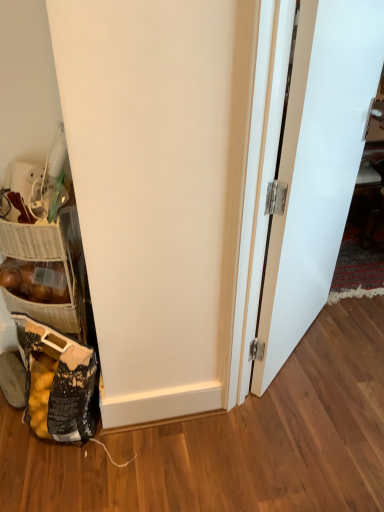
Question: Choose the correct answer: Is woven brown basket at lower left inside black plastic bag at lower left or outside it?

Choices:
 (A) inside
 (B) outside

Answer: (B)

Question: Is woven brown basket at lower left taller or shorter than black plastic bag at lower left?

Choices:
 (A) short
 (B) tall

Answer: (A)

Question: Estimate the real-world distances between objects in this image. Which object is farther from the woven brown basket at lower left?

Choices:
 (A) black plastic bag at lower left
 (B) white matte door at right

Answer: (B)

Question: Which of these objects is positioned closest to the woven brown basket at lower left?

Choices:
 (A) black plastic bag at lower left
 (B) white matte door at right

Answer: (A)